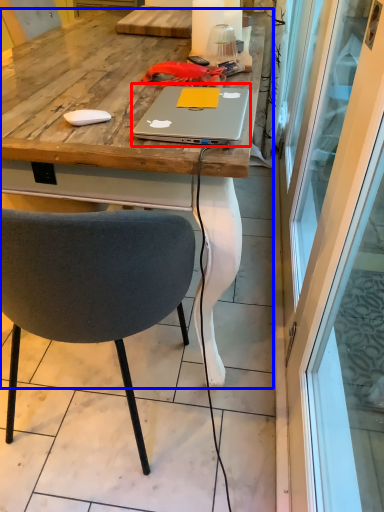
Question: Which object is closer to the camera taking this photo, laptop (highlighted by a red box) or desk (highlighted by a blue box)?

Choices:
 (A) laptop
 (B) desk

Answer: (A)